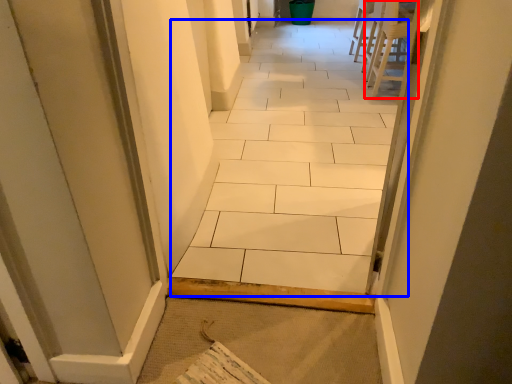
Question: Which object appears closest to the camera in this image, chair (highlighted by a red box) or ceramic tile (highlighted by a blue box)?

Choices:
 (A) chair
 (B) ceramic tile

Answer: (B)